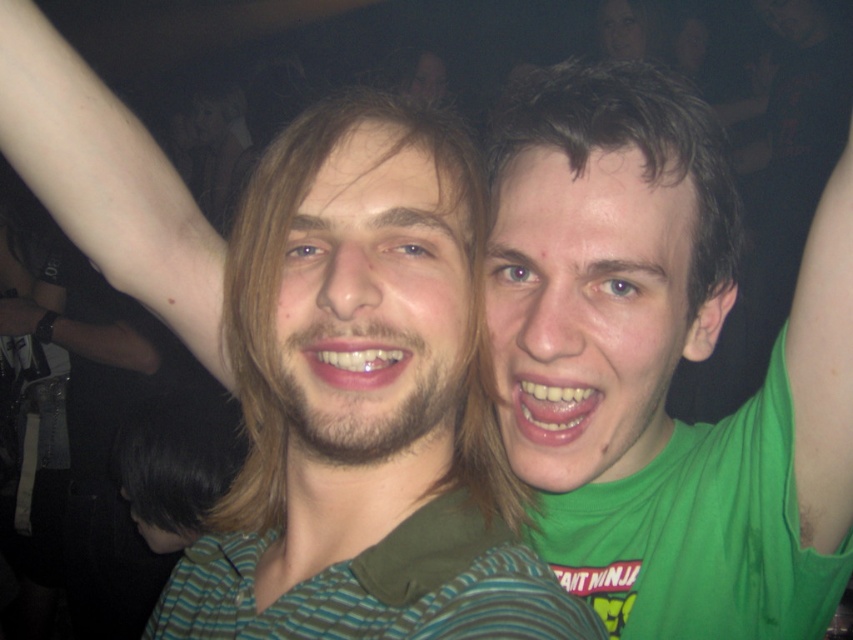
You are at a party and want to take a photo of the green matte tank top at right and the smooth skin face at upper right. Which object should you zoom in on to ensure both are in focus?

The green matte tank top at right is larger in size than the smooth skin face at upper right, so you should zoom in on the green matte tank top at right to ensure both are in focus.

You are at a party and want to give a gift to the person wearing the green matte shirt at center. If you walk straight ahead, will you pass by the green matte tank top at right before reaching your target?

The green matte shirt at center is to the left of the green matte tank top at right. Since you are walking straight ahead, you would pass by the green matte tank top at right first before reaching the green matte shirt at center, so yes, you will pass by the tank top before reaching the shirt.

You are a photographer at the event and want to capture a clear photo of both the green matte shirt at center and the smooth skin face at upper right. Considering their sizes, which object should you focus on first to ensure both are in focus?

The green matte shirt at center is larger than the smooth skin face at upper right, so you should focus on the green matte shirt at center first to ensure both are in focus.